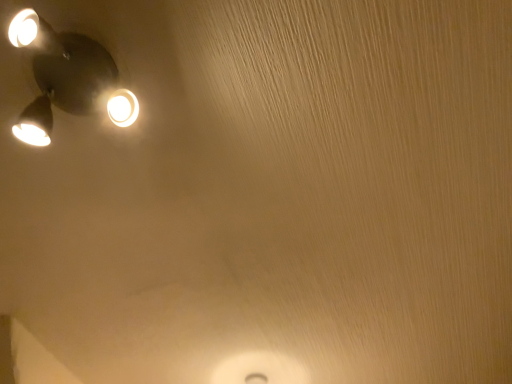
At what (x,y) coordinates should I click in order to perform the action: click on matte white lamp at upper left. Please return your answer as a coordinate pair (x, y). The width and height of the screenshot is (512, 384). Looking at the image, I should click on (60, 74).

This screenshot has height=384, width=512. Describe the element at coordinates (60, 74) in the screenshot. I see `matte white lamp at upper left` at that location.

You are a GUI agent. You are given a task and a screenshot of the screen. Output one action in this format:
    pyautogui.click(x=<x>, y=<y>)
    Task: Click on the matte white lamp at upper left
    The height and width of the screenshot is (384, 512).
    Given the screenshot: What is the action you would take?
    pos(60,74)